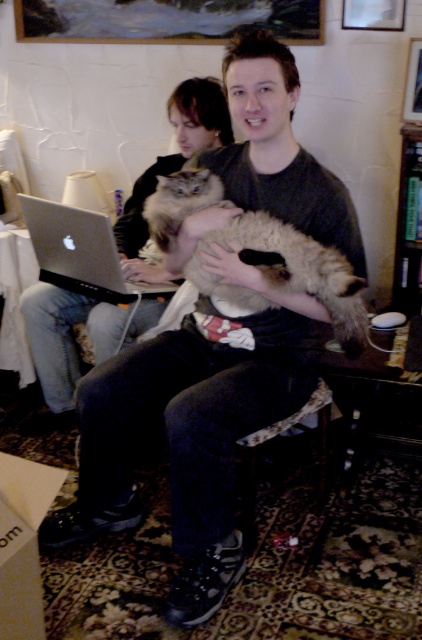
Is point (148, 269) positioned before point (397, 241)?

That is False.

Does point (141, 243) come behind point (403, 241)?

That is True.

You are a GUI agent. You are given a task and a screenshot of the screen. Output one action in this format:
    pyautogui.click(x=<x>, y=<y>)
    Task: Click on the fluffy cat at center
    
    Given the screenshot: What is the action you would take?
    pyautogui.click(x=64, y=344)

Who is lower down, fluffy cat at center or silver metallic laptop at left?

fluffy cat at center is lower down.

Who is higher up, fluffy cat at center or silver metallic laptop at left?

silver metallic laptop at left is higher up.

I want to click on fluffy cat at center, so click(x=64, y=344).

The image size is (422, 640). What do you see at coordinates (81, 252) in the screenshot?
I see `silver metallic laptop at left` at bounding box center [81, 252].

Between point (113, 268) and point (408, 301), which one is positioned behind?

Positioned behind is point (408, 301).

Which is in front, point (113, 275) or point (403, 292)?

Point (113, 275) is in front.

Identify the location of silver metallic laptop at left. This screenshot has height=640, width=422. (81, 252).